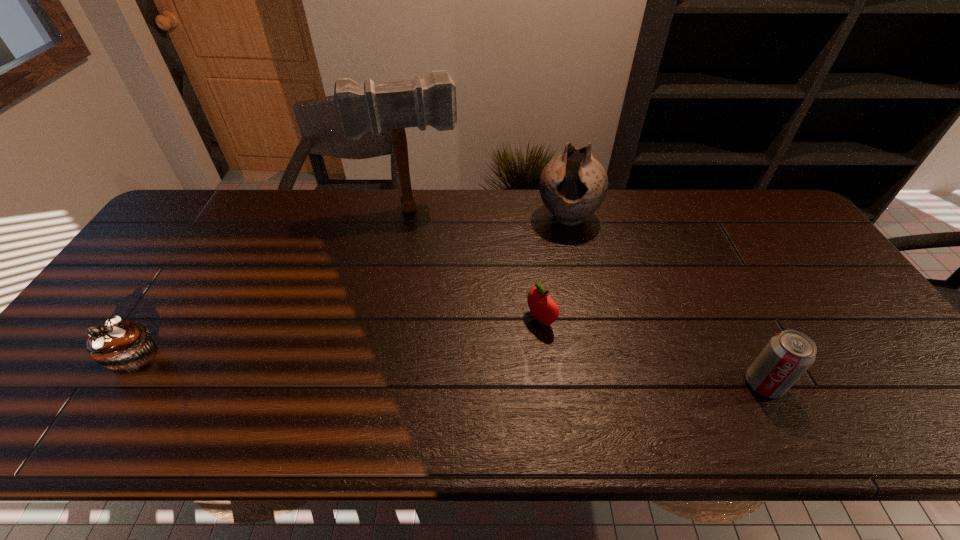
The width and height of the screenshot is (960, 540). What are the coordinates of `empty location between the third farthest object and the soda can` in the screenshot? It's located at (652, 352).

Where is `vacant area that lies between the second tallest object and the soda can`? This screenshot has width=960, height=540. vacant area that lies between the second tallest object and the soda can is located at coordinates (665, 300).

At what (x,y) coordinates should I click in order to perform the action: click on free spot between the pottery and the rightmost object. Please return your answer as a coordinate pair (x, y). Image resolution: width=960 pixels, height=540 pixels. Looking at the image, I should click on (665, 300).

The width and height of the screenshot is (960, 540). What are the coordinates of `free space between the cupcake and the mallet` in the screenshot? It's located at (273, 284).

Find the location of a particular element. vacant space that is in between the second tallest object and the third shortest object is located at coordinates (665, 300).

Find the location of a particular element. Image resolution: width=960 pixels, height=540 pixels. empty space between the fourth object from right to left and the apple is located at coordinates (476, 264).

In order to click on free area in between the soda can and the fourth object from right to left in this screenshot , I will do `click(588, 296)`.

Find the location of a particular element. The image size is (960, 540). vacant area that lies between the second tallest object and the apple is located at coordinates (554, 268).

This screenshot has width=960, height=540. Find the location of `free spot between the fourth shortest object and the rightmost object`. free spot between the fourth shortest object and the rightmost object is located at coordinates (665, 300).

Locate an element on the screen. vacant space that's between the pottery and the rightmost object is located at coordinates (665, 300).